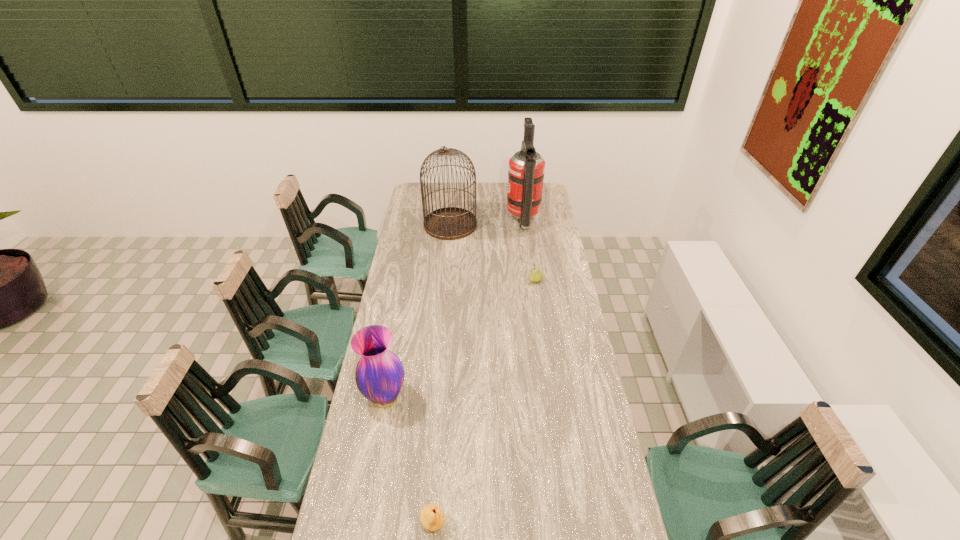
At what (x,y) coordinates should I click in order to perform the action: click on vacant space that is in between the shortest object and the second nearest object. Please return your answer as a coordinate pair (x, y). The height and width of the screenshot is (540, 960). Looking at the image, I should click on click(409, 461).

I want to click on free area in between the fourth shortest object and the fire extinguisher, so click(487, 223).

Point out which object is positioned as the fourth nearest to the shortest object. Please provide its 2D coordinates. Your answer should be formatted as a tuple, i.e. [(x, y)], where the tuple contains the x and y coordinates of a point satisfying the conditions above.

[(526, 169)]

At what (x,y) coordinates should I click in order to perform the action: click on object that ranks as the second closest to the left pear. Please return your answer as a coordinate pair (x, y). The image size is (960, 540). Looking at the image, I should click on (535, 275).

This screenshot has height=540, width=960. What are the coordinates of `free space in the image that satisfies the following two spatial constraints: 1. on the front label side of the right pear; 2. on the right side of the fire extinguisher` in the screenshot? It's located at (531, 280).

Identify the location of free space that satisfies the following two spatial constraints: 1. on the back side of the nearest object; 2. on the right side of the farther pear. The image size is (960, 540). (451, 280).

The height and width of the screenshot is (540, 960). What are the coordinates of `free space in the image that satisfies the following two spatial constraints: 1. on the front label side of the fire extinguisher; 2. on the front side of the fourth shortest object` in the screenshot? It's located at (523, 225).

Where is `vacant space that satisfies the following two spatial constraints: 1. on the front label side of the tallest object; 2. on the left side of the third nearest object`? vacant space that satisfies the following two spatial constraints: 1. on the front label side of the tallest object; 2. on the left side of the third nearest object is located at coordinates (x=531, y=280).

Find the location of a particular element. The image size is (960, 540). free location that satisfies the following two spatial constraints: 1. on the front side of the shorter pear; 2. on the right side of the second nearest object is located at coordinates (362, 524).